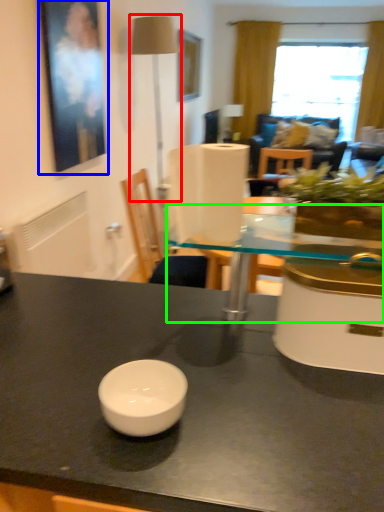
Question: Based on their relative distances, which object is farther from table lamp (highlighted by a red box)? Choose from picture frame (highlighted by a blue box) and round table (highlighted by a green box).

Choices:
 (A) picture frame
 (B) round table

Answer: (B)